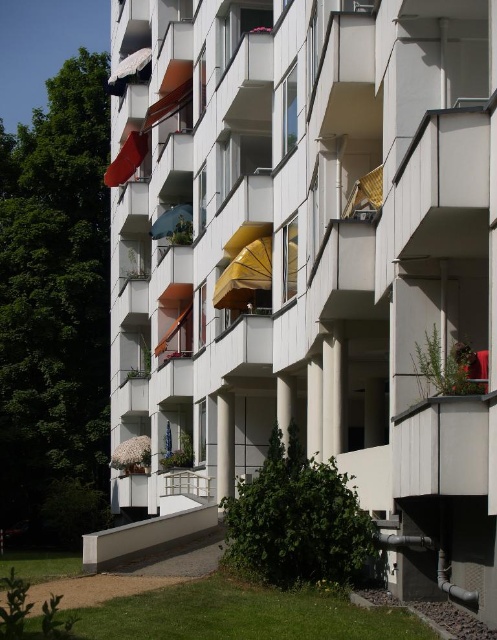
You are standing in front of the residential building and notice two points on its facade. The first point is at coordinate (220, 276) and the second is at (175, 209). Which of these two points is closer to you?

Point (220, 276) is closer to the viewer than point (175, 209).

You are an architect evaluating the placement of the yellow fabric umbrella at center and the blue fabric umbrella at center on the balcony. Which umbrella has a greater width?

The yellow fabric umbrella at center has a greater width than the blue fabric umbrella at center.